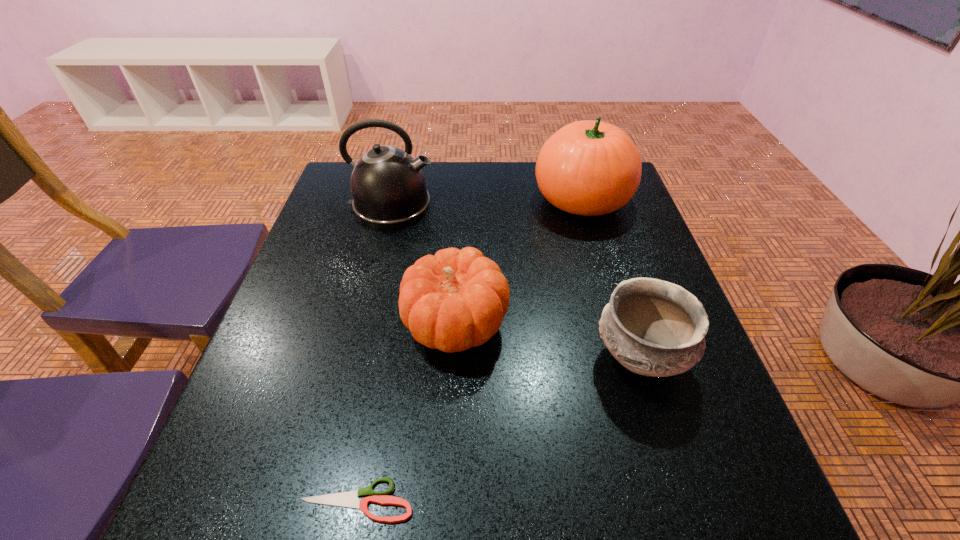
Find the location of a particular element. free location located 0.240m on the front of the left pumpkin is located at coordinates (446, 504).

Locate an element on the screen. The width and height of the screenshot is (960, 540). vacant area situated on the back of the pottery is located at coordinates (615, 279).

The image size is (960, 540). Identify the location of vacant space situated 0.100m on the right of the shortest object. click(479, 500).

I want to click on kettle present at the far edge, so click(x=388, y=187).

Image resolution: width=960 pixels, height=540 pixels. In order to click on pumpkin positioned at the far edge in this screenshot , I will do `click(590, 168)`.

Find the location of a particular element. object present at the near edge is located at coordinates (350, 499).

Identify the location of kettle that is at the left edge. (388, 187).

This screenshot has width=960, height=540. Identify the location of scissors at the left edge. (350, 499).

Locate an element on the screen. pumpkin present at the right edge is located at coordinates (590, 168).

The width and height of the screenshot is (960, 540). I want to click on pottery that is at the right edge, so click(652, 327).